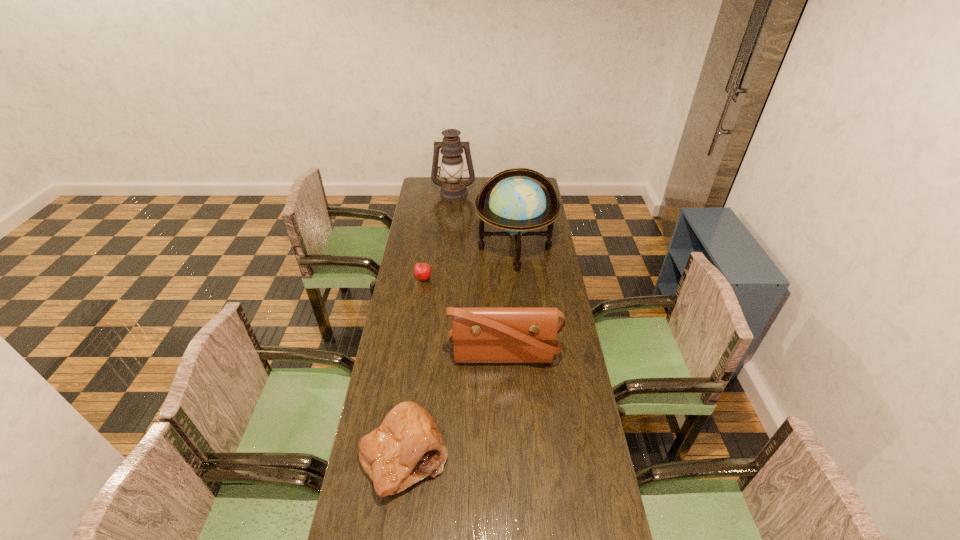
Locate an element on the screen. vacant area at the right edge is located at coordinates (535, 240).

You are a GUI agent. You are given a task and a screenshot of the screen. Output one action in this format:
    pyautogui.click(x=<x>, y=<y>)
    Task: Click on the vacant point at the far left corner
    The width and height of the screenshot is (960, 540).
    Given the screenshot: What is the action you would take?
    pyautogui.click(x=420, y=185)

What are the coordinates of `unoccupied area between the bread and the apple` in the screenshot? It's located at (414, 367).

You are a GUI agent. You are given a task and a screenshot of the screen. Output one action in this format:
    pyautogui.click(x=<x>, y=<y>)
    Task: Click on the vacant area that lies between the nearest object and the farthest object
    
    Given the screenshot: What is the action you would take?
    429,325

Locate an element on the screen. free space between the fourth tallest object and the third shortest object is located at coordinates (454, 406).

You are a GUI agent. You are given a task and a screenshot of the screen. Output one action in this format:
    pyautogui.click(x=<x>, y=<y>)
    Task: Click on the free space between the shortest object and the globe
    This screenshot has width=960, height=540.
    Given the screenshot: What is the action you would take?
    pyautogui.click(x=469, y=264)

This screenshot has width=960, height=540. Identify the location of object that ranks as the fourth closest to the globe. (407, 447).

Identify which object is the fourth closest to the apple. Please provide its 2D coordinates. Your answer should be formatted as a tuple, i.e. [(x, y)], where the tuple contains the x and y coordinates of a point satisfying the conditions above.

[(407, 447)]